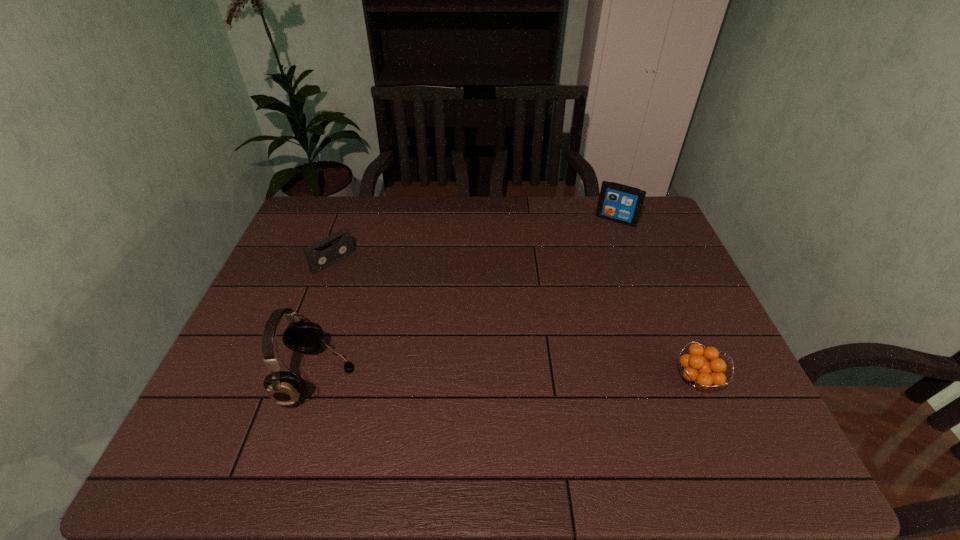
Image resolution: width=960 pixels, height=540 pixels. Find the location of `vacant spot on the desktop that is between the headset and the orange fruit and is positioned on the front screen of the iPod`. vacant spot on the desktop that is between the headset and the orange fruit and is positioned on the front screen of the iPod is located at coordinates (529, 379).

Where is `free space on the desktop that is between the tallest object and the orange fruit and is positioned on the front-facing side of the videotape`? free space on the desktop that is between the tallest object and the orange fruit and is positioned on the front-facing side of the videotape is located at coordinates (471, 378).